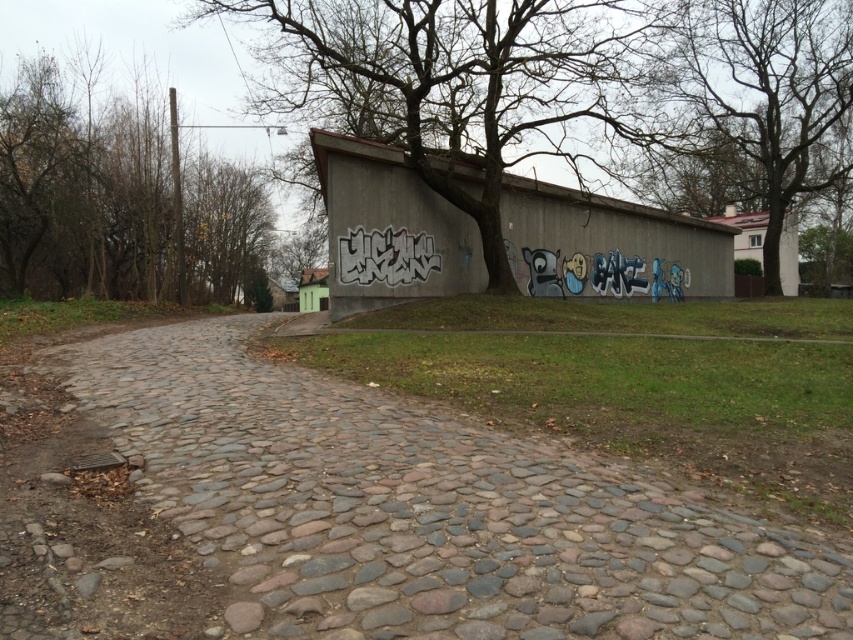
You are standing at the point marked as point (451, 83) in the image. What do you see directly above you?

You see bare branches at center directly above you since the point (451, 83) corresponds to that location.

You are a gardener who needs to water the gray cobblestone path at center and the bare branches at center. Since the water hose is only 60 feet long, can you reach both objects without moving the hose? Please explain your reasoning.

The gray cobblestone path at center is 62.04 feet from the bare branches at center. Since the hose is only 60 feet long, it cannot reach both objects simultaneously without moving the hose. The distance between them exceeds the hose length by approximately 2.04 feet.